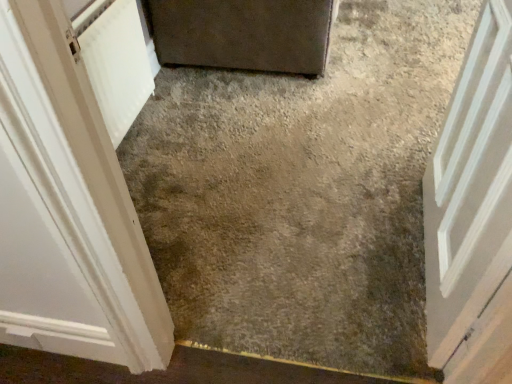
Question: Considering the positions of matte gray door at upper center, the 2th door positioned from the right, and gray concrete at center in the image, is matte gray door at upper center, the 2th door positioned from the right, wider or thinner than gray concrete at center?

Choices:
 (A) thin
 (B) wide

Answer: (A)

Question: From a real-world perspective, relative to gray concrete at center, is matte gray door at upper center, which is the 2th door in left-to-right order, vertically above or below?

Choices:
 (A) above
 (B) below

Answer: (A)

Question: Which object is the farthest from the matte gray door at upper center, the 2th door positioned from the right?

Choices:
 (A) white painted wood door at center, which ranks as the 1th door in right-to-left order
 (B) gray concrete at center
 (C) white painted wood door at left, the 3th door positioned from the right

Answer: (C)

Question: Which object is the closest to the matte gray door at upper center, which is the 2th door in left-to-right order?

Choices:
 (A) gray concrete at center
 (B) white painted wood door at center, which ranks as the 1th door in right-to-left order
 (C) white painted wood door at left, the 3th door positioned from the right

Answer: (A)